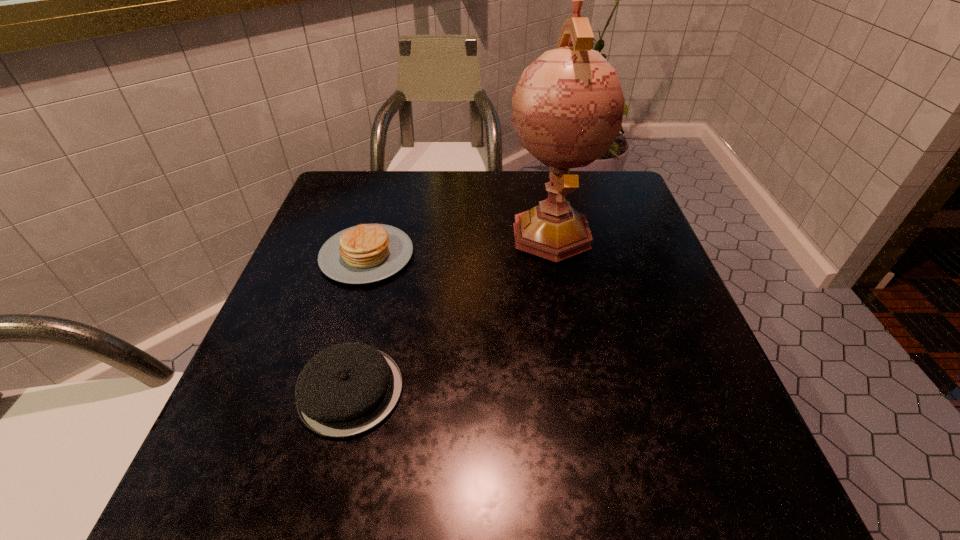
Find the location of a particular element. vacant space at the far edge is located at coordinates (397, 198).

Locate an element on the screen. The width and height of the screenshot is (960, 540). blank space at the near edge of the desktop is located at coordinates (329, 496).

Identify the location of free point at the left edge. The image size is (960, 540). 308,281.

This screenshot has width=960, height=540. Find the location of `free space at the right edge of the desktop`. free space at the right edge of the desktop is located at coordinates (653, 273).

Identify the location of vacant region at the far left corner. (337, 215).

The width and height of the screenshot is (960, 540). What are the coordinates of `free space at the near left corner of the desktop` in the screenshot? It's located at (190, 509).

Identify the location of free space at the near right corner. This screenshot has width=960, height=540. (732, 490).

Identify the location of vacant space that's between the rightmost object and the farther pancake. (459, 244).

What are the coordinates of `free space between the tallest object and the farther pancake` in the screenshot? It's located at (459, 244).

Where is `empty space between the nearest object and the farther pancake`? empty space between the nearest object and the farther pancake is located at coordinates [x=359, y=323].